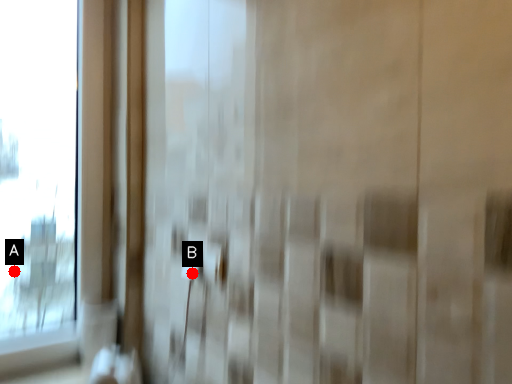
Question: Two points are circled on the image, labeled by A and B beside each circle. Which point is farther to the camera?

Choices:
 (A) A is further
 (B) B is further

Answer: (A)